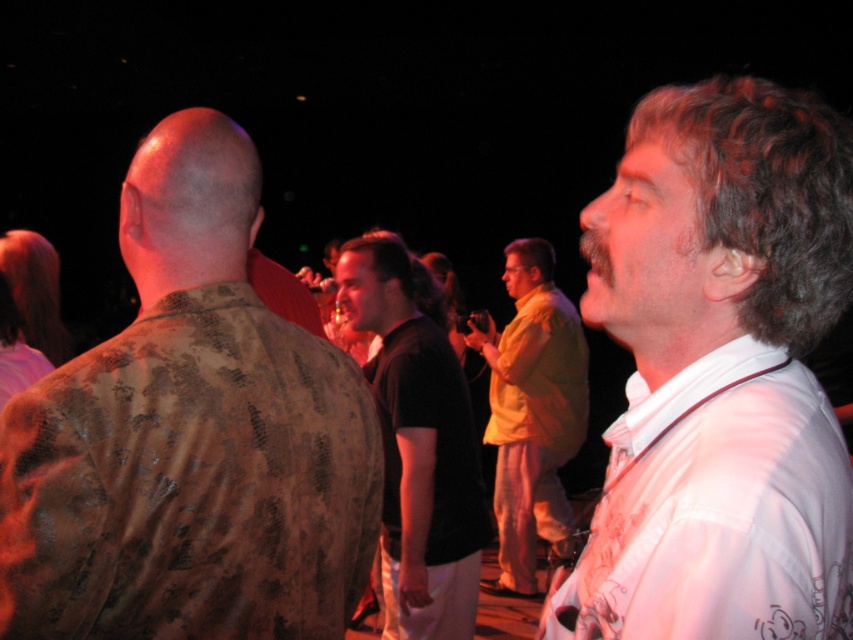
Who is lower down, camouflage shirt at left or black cotton shirt at center?

Positioned lower is black cotton shirt at center.

This screenshot has width=853, height=640. What do you see at coordinates (190, 436) in the screenshot?
I see `camouflage shirt at left` at bounding box center [190, 436].

Identify the location of camouflage shirt at left. Image resolution: width=853 pixels, height=640 pixels. 190,436.

Does white satin shirt at right have a smaller size compared to black cotton shirt at center?

Correct, white satin shirt at right occupies less space than black cotton shirt at center.

Does point (717, 317) come farther from viewer compared to point (427, 424)?

That is False.

The height and width of the screenshot is (640, 853). In order to click on white satin shirt at right in this screenshot , I will do `click(718, 372)`.

Does white satin shirt at right appear under yellow fabric shirt at center?

No, white satin shirt at right is not below yellow fabric shirt at center.

Who is lower down, white satin shirt at right or yellow fabric shirt at center?

yellow fabric shirt at center

This screenshot has height=640, width=853. I want to click on white satin shirt at right, so click(718, 372).